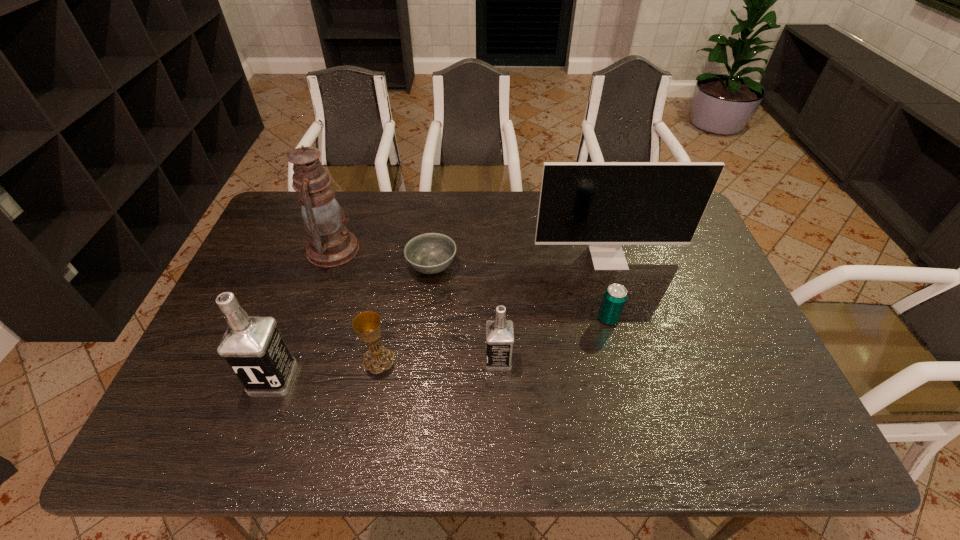
With all vodkas evenly spaced, where should an extra vodka be placed on the right to continue the pattern? Please point out a vacant space. Please provide its 2D coordinates. Your answer should be formatted as a tuple, i.e. [(x, y)], where the tuple contains the x and y coordinates of a point satisfying the conditions above.

[(708, 342)]